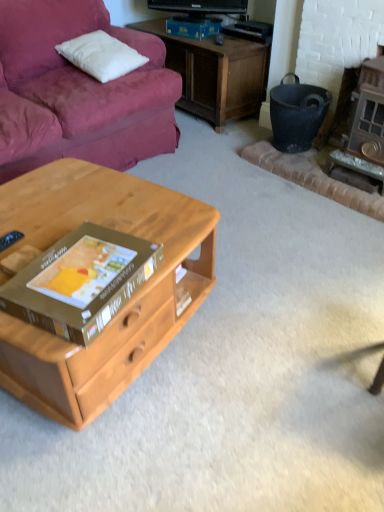
Measure the distance between point (x=303, y=116) and camera.

Point (x=303, y=116) is 7.44 feet from camera.

Describe the element at coordinates (101, 55) in the screenshot. The width and height of the screenshot is (384, 512). I see `white soft pillow at upper left` at that location.

What do you see at coordinates (123, 307) in the screenshot? This screenshot has width=384, height=512. I see `light wood desk at center` at bounding box center [123, 307].

Describe the element at coordinates (81, 282) in the screenshot. The image size is (384, 512). I see `brown cardboard box at center` at that location.

In order to click on black matte trash bin/can at right in this screenshot , I will do `click(297, 114)`.

From the image's perspective, between black matte trash bin/can at right and white soft pillow at upper left, who is located below?

black matte trash bin/can at right is shown below in the image.

Is white soft pillow at upper left located within black matte trash bin/can at right?

No, white soft pillow at upper left is not surrounded by black matte trash bin/can at right.

The width and height of the screenshot is (384, 512). Find the location of `trash bin/can on the right of white soft pillow at upper left`. trash bin/can on the right of white soft pillow at upper left is located at coordinates (297, 114).

From a real-world perspective, is black matte trash bin/can at right located beneath white soft pillow at upper left?

Yes, from a real-world perspective, black matte trash bin/can at right is under white soft pillow at upper left.

Can you confirm if white soft pillow at upper left is smaller than light wood desk at center?

Yes, white soft pillow at upper left is smaller than light wood desk at center.

I want to click on pillow above the light wood desk at center (from a real-world perspective), so click(101, 55).

Considering the sizes of objects white soft pillow at upper left and light wood desk at center in the image provided, who is taller, white soft pillow at upper left or light wood desk at center?

light wood desk at center is taller.

Is light wood desk at center surrounded by white soft pillow at upper left?

No, light wood desk at center is not surrounded by white soft pillow at upper left.

Is brown cardboard box at center facing away from light wood desk at center?

brown cardboard box at center does not have its back to light wood desk at center.

Between point (61, 302) and point (120, 209), which one is positioned behind?

Point (120, 209)

Do you think brown cardboard box at center is within light wood desk at center, or outside of it?

brown cardboard box at center is not inside light wood desk at center, it's outside.

Can you confirm if brown cardboard box at center is wider than light wood desk at center?

No.

Is wooden fireplace at right closer to the viewer compared to brown cardboard box at center?

No, wooden fireplace at right is behind brown cardboard box at center.

Is point (340, 155) positioned before point (33, 293)?

No, (340, 155) is behind (33, 293).

Considering the relative positions of wooden fireplace at right and brown cardboard box at center in the image provided, is wooden fireplace at right to the right of brown cardboard box at center from the viewer's perspective?

Indeed, wooden fireplace at right is positioned on the right side of brown cardboard box at center.

The height and width of the screenshot is (512, 384). I want to click on fireplace located on the right of white soft pillow at upper left, so click(x=364, y=131).

Based on their sizes in the image, would you say wooden fireplace at right is bigger or smaller than white soft pillow at upper left?

In the image, wooden fireplace at right appears to be larger than white soft pillow at upper left.

Is wooden fireplace at right not close to white soft pillow at upper left?

Yes.

From the image's perspective, between wooden fireplace at right and white soft pillow at upper left, which one is located above?

From the image's view, white soft pillow at upper left is above.

At what (x,y) coordinates should I click in order to perform the action: click on trash bin/can lying above the brown cardboard box at center (from the image's perspective). Please return your answer as a coordinate pair (x, y). Looking at the image, I should click on (297, 114).

From a real-world perspective, is black matte trash bin/can at right positioned above or below brown cardboard box at center?

Clearly, from a real-world perspective, black matte trash bin/can at right is below brown cardboard box at center.

Could you tell me if black matte trash bin/can at right is facing brown cardboard box at center?

Yes, black matte trash bin/can at right is facing brown cardboard box at center.

Is point (293, 87) closer or farther from the camera than point (52, 318)?

Point (293, 87) is farther from the camera than point (52, 318).

Can you confirm if black matte trash bin/can at right is taller than light wood desk at center?

In fact, black matte trash bin/can at right may be shorter than light wood desk at center.

Image resolution: width=384 pixels, height=512 pixels. I want to click on trash bin/can above the light wood desk at center (from a real-world perspective), so click(297, 114).

Is black matte trash bin/can at right turned away from light wood desk at center?

black matte trash bin/can at right is not turned away from light wood desk at center.

Is black matte trash bin/can at right bigger or smaller than light wood desk at center?

black matte trash bin/can at right is smaller than light wood desk at center.

Where is `trash bin/can behind the white soft pillow at upper left`? The width and height of the screenshot is (384, 512). trash bin/can behind the white soft pillow at upper left is located at coordinates pyautogui.click(x=297, y=114).

Find the location of a particular element. This screenshot has height=512, width=384. pillow above the light wood desk at center (from the image's perspective) is located at coordinates (101, 55).

When comparing their distances from black matte trash bin/can at right, does brown cardboard box at center or light wood desk at center seem closer?

light wood desk at center lies closer to black matte trash bin/can at right than the other object.

Based on their spatial positions, is white soft pillow at upper left or black matte trash bin/can at right further from wooden fireplace at right?

white soft pillow at upper left lies further to wooden fireplace at right than the other object.

Considering their positions, is wooden fireplace at right positioned closer to light wood desk at center than white soft pillow at upper left?

Based on the image, white soft pillow at upper left appears to be nearer to light wood desk at center.

When comparing their distances from wooden fireplace at right, does light wood desk at center or brown cardboard box at center seem further?

The object further to wooden fireplace at right is brown cardboard box at center.

Considering their positions, is wooden fireplace at right positioned further to brown cardboard box at center than light wood desk at center?

Based on the image, wooden fireplace at right appears to be further to brown cardboard box at center.

Consider the image. When comparing their distances from white soft pillow at upper left, does brown cardboard box at center or light wood desk at center seem closer?

Based on the image, light wood desk at center appears to be nearer to white soft pillow at upper left.

From the image, which object appears to be farther from brown cardboard box at center, black matte trash bin/can at right or white soft pillow at upper left?

Among the two, black matte trash bin/can at right is located further to brown cardboard box at center.

Estimate the real-world distances between objects in this image. Which object is further from black matte trash bin/can at right, brown cardboard box at center or white soft pillow at upper left?

brown cardboard box at center is positioned further to the anchor black matte trash bin/can at right.

Locate an element on the screen. This screenshot has height=512, width=384. box between white soft pillow at upper left and light wood desk at center vertically is located at coordinates tap(81, 282).

You are a GUI agent. You are given a task and a screenshot of the screen. Output one action in this format:
    pyautogui.click(x=<x>, y=<y>)
    Task: Click on the trash bin/can between white soft pillow at upper left and wooden fireplace at right from left to right
    
    Given the screenshot: What is the action you would take?
    (297, 114)

The width and height of the screenshot is (384, 512). I want to click on pillow between light wood desk at center and black matte trash bin/can at right from front to back, so click(x=101, y=55).

Identify the location of pillow positioned between brown cardboard box at center and black matte trash bin/can at right from near to far. The width and height of the screenshot is (384, 512). coord(101,55).